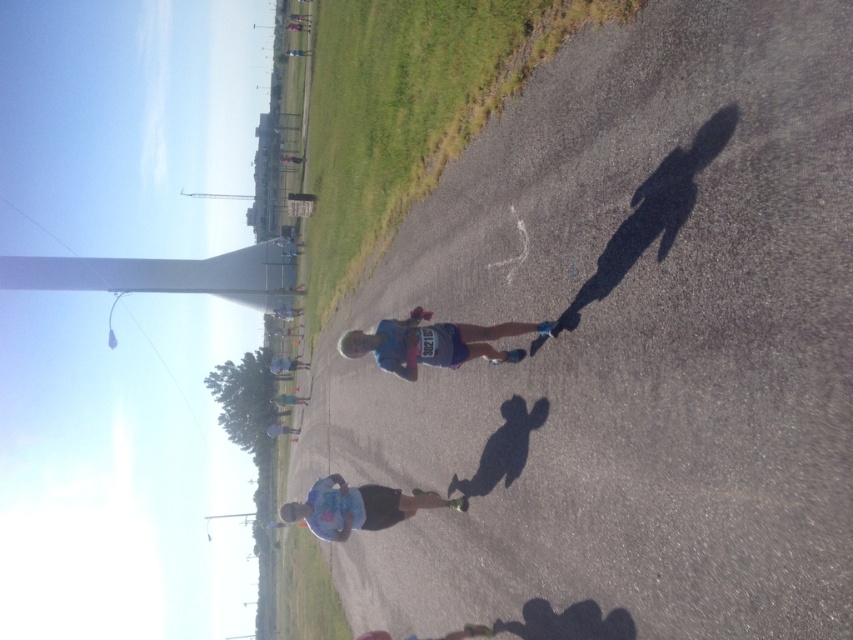
Question: Can you confirm if blue fabric skateboard at center is positioned to the right of light blue fabric skateboard at center?

Choices:
 (A) no
 (B) yes

Answer: (B)

Question: Is blue fabric skateboard at center smaller than light blue fabric skateboard at center?

Choices:
 (A) yes
 (B) no

Answer: (B)

Question: Which object is closer to the camera taking this photo?

Choices:
 (A) light blue fabric skateboard at center
 (B) blue fabric skateboard at center

Answer: (B)

Question: Does blue fabric skateboard at center have a smaller size compared to light blue fabric skateboard at center?

Choices:
 (A) no
 (B) yes

Answer: (A)

Question: Which of the following is the closest to the observer?

Choices:
 (A) (299, 516)
 (B) (474, 346)

Answer: (B)

Question: Which object appears farthest from the camera in this image?

Choices:
 (A) light blue fabric skateboard at center
 (B) blue fabric skateboard at center

Answer: (A)